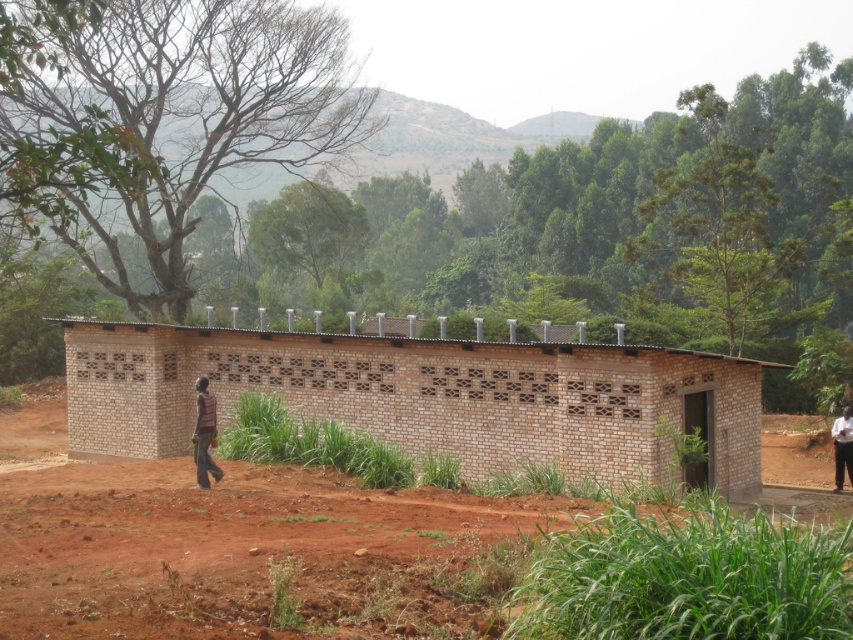
You are standing in a rural area and see the brown dirt field at center and the brown brick hut at center. Which object is closer to you?

The brown dirt field at center is in front of the brown brick hut at center, so it is closer to you.

You are standing in front of the brick structure and want to walk to the brown dirt field at center. According to the coordinates provided, in which direction should you head from the structure?

The brown dirt field at center is located at coordinates point [256,554], which means it is positioned to the right and slightly forward from the brick structure. You should head towards the right side from the structure to reach the brown dirt field at center.